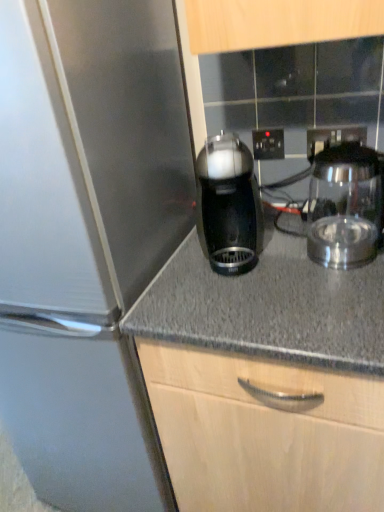
Question: From the image's perspective, relative to black plastic electric outlet at center, which appears as the second electric outlet when viewed from the right, is black plastic coffee maker at center, acting as the first kitchen appliance starting from the left, above or below?

Choices:
 (A) below
 (B) above

Answer: (A)

Question: From a real-world perspective, is black plastic coffee maker at center, which appears as the second kitchen appliance when viewed from the right, above or below black plastic electric outlet at center, which ranks as the 1th electric outlet in left-to-right order?

Choices:
 (A) below
 (B) above

Answer: (A)

Question: Which object is positioned farthest from the black plastic electric outlet at center, which ranks as the 1th electric outlet in left-to-right order?

Choices:
 (A) transparent glass carafe at right, the first kitchen appliance from the right
 (B) black plastic electric outlet at upper center, which is the first electric outlet from right to left
 (C) black plastic coffee maker at center, which appears as the second kitchen appliance when viewed from the right

Answer: (C)

Question: Based on their relative distances, which object is nearer to the black plastic coffee maker at center, acting as the first kitchen appliance starting from the left?

Choices:
 (A) black plastic electric outlet at center, the second electric outlet positioned from the front
 (B) black plastic electric outlet at upper center, which appears as the second electric outlet when viewed from the back
 (C) transparent glass carafe at right, the first kitchen appliance from the right

Answer: (C)